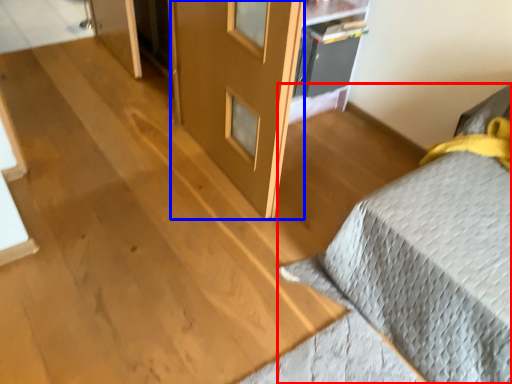
Question: Which object is further to the camera taking this photo, furniture (highlighted by a red box) or screen door (highlighted by a blue box)?

Choices:
 (A) furniture
 (B) screen door

Answer: (B)